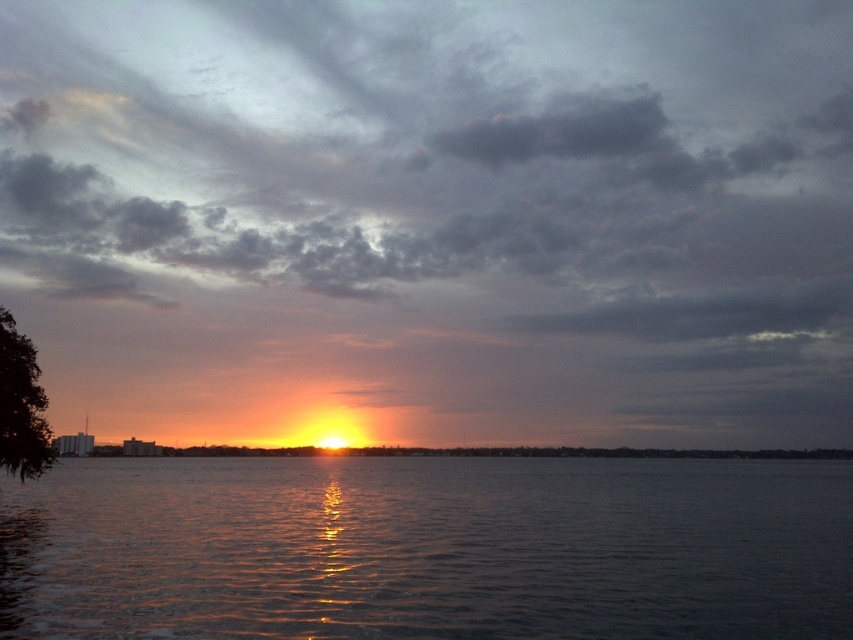
Question: Which point is closer to the camera?

Choices:
 (A) green leafy tree at left
 (B) dark gray cloud at upper center
 (C) glistening dark water at center

Answer: (C)

Question: Which point is farther to the camera?

Choices:
 (A) (32, 454)
 (B) (560, 554)
 (C) (22, 202)

Answer: (C)

Question: Can you confirm if dark gray cloud at upper center is positioned above glistening dark water at center?

Choices:
 (A) no
 (B) yes

Answer: (B)

Question: Can you confirm if glistening dark water at center is positioned to the left of green leafy tree at left?

Choices:
 (A) yes
 (B) no

Answer: (B)

Question: Is glistening dark water at center in front of green leafy tree at left?

Choices:
 (A) yes
 (B) no

Answer: (A)

Question: Among these objects, which one is farthest from the camera?

Choices:
 (A) green leafy tree at left
 (B) dark gray cloud at upper center
 (C) glistening dark water at center

Answer: (B)